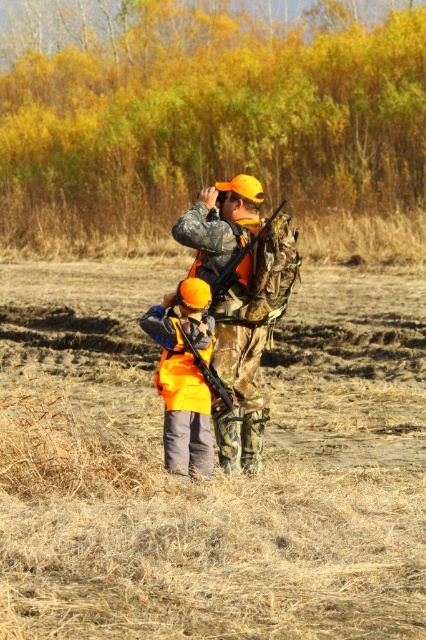
Question: Does camouflage fabric rifle at center appear over matte black shotgun at center?

Choices:
 (A) no
 (B) yes

Answer: (A)

Question: Considering the real-world distances, which object is farthest from the matte orange shotgun at center?

Choices:
 (A) camouflage fabric rifle at center
 (B) matte black shotgun at center
 (C) brown dry grass at center

Answer: (C)

Question: Does camouflage fabric rifle at center lie in front of matte black shotgun at center?

Choices:
 (A) no
 (B) yes

Answer: (B)

Question: Is brown dry grass at center closer to the viewer compared to camouflage fabric rifle at center?

Choices:
 (A) yes
 (B) no

Answer: (A)

Question: Among these points, which one is farthest from the camera?

Choices:
 (A) (333, 301)
 (B) (256, 410)
 (C) (198, 360)
 (D) (221, 273)

Answer: (A)

Question: Which is farther from the camouflage fabric rifle at center?

Choices:
 (A) brown dry grass at center
 (B) matte black shotgun at center

Answer: (A)